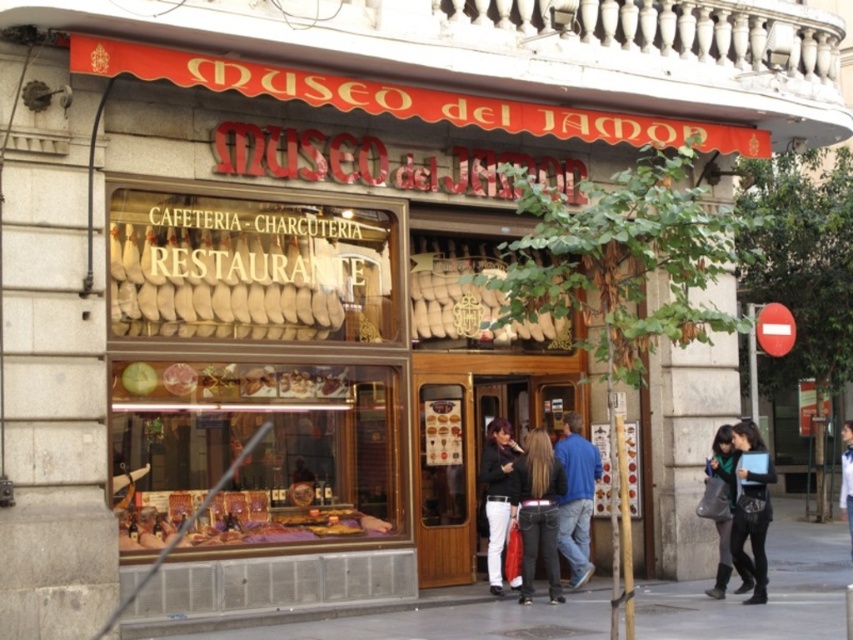
Looking at this image, does white leather baguette at center have a lesser height compared to black leather jacket at center?

Indeed, white leather baguette at center has a lesser height compared to black leather jacket at center.

Which is more to the left, white leather baguette at center or black leather jacket at center?

Positioned to the left is white leather baguette at center.

What do you see at coordinates (222, 282) in the screenshot?
I see `white leather baguette at center` at bounding box center [222, 282].

Find the location of a particular element. The image size is (853, 640). white leather baguette at center is located at coordinates (222, 282).

Is shiny purple cloth at center shorter than dark blue fabric jacket at lower right?

Yes.

Who is more forward, (251, 538) or (723, 452)?

Positioned in front is point (251, 538).

The image size is (853, 640). Find the location of `shiny purple cloth at center`. shiny purple cloth at center is located at coordinates (277, 518).

Which is more to the left, shiny purple cloth at center or light blue denim jacket at lower right?

Positioned to the left is shiny purple cloth at center.

The image size is (853, 640). Describe the element at coordinates (277, 518) in the screenshot. I see `shiny purple cloth at center` at that location.

Between point (297, 531) and point (846, 513), which one is positioned in front?

Point (297, 531) is more forward.

Identify the location of shiny purple cloth at center. (277, 518).